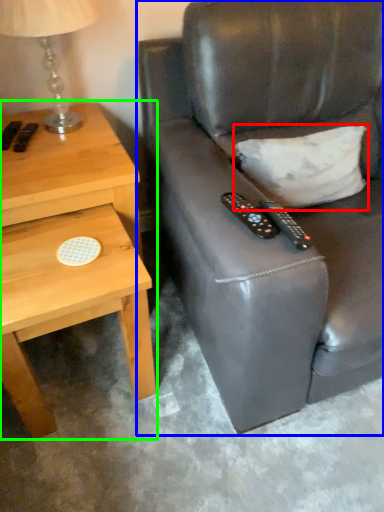
Question: Estimate the real-world distances between objects in this image. Which object is farther from pillow (highlighted by a red box), chair (highlighted by a blue box) or nightstand (highlighted by a green box)?

Choices:
 (A) chair
 (B) nightstand

Answer: (B)